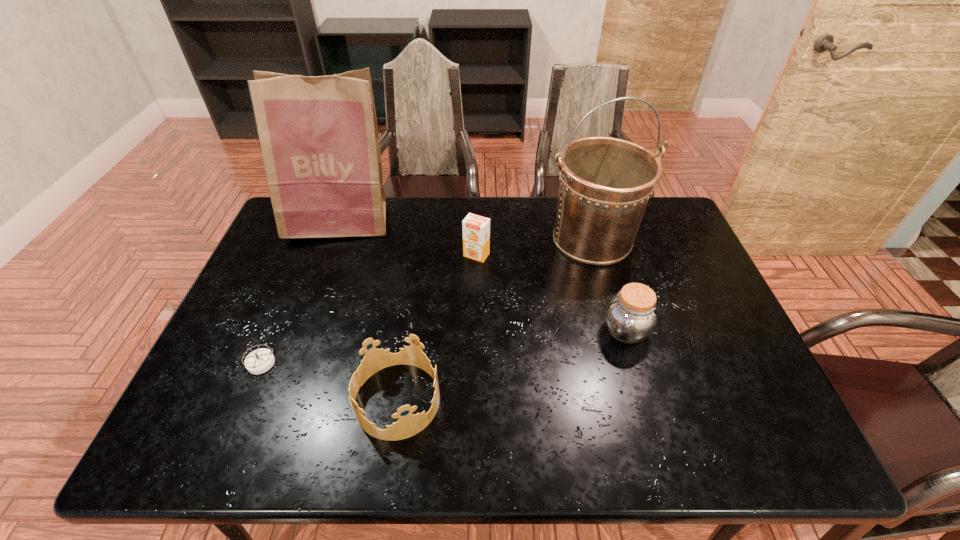
The width and height of the screenshot is (960, 540). Find the location of `blank area located on the front-facing side of the tiara`. blank area located on the front-facing side of the tiara is located at coordinates (593, 400).

You are a GUI agent. You are given a task and a screenshot of the screen. Output one action in this format:
    pyautogui.click(x=<x>, y=<y>)
    Task: Click on the free location located on the front of the compass
    
    Given the screenshot: What is the action you would take?
    pyautogui.click(x=247, y=395)

In order to click on grocery bag that is at the far edge in this screenshot , I will do `click(318, 135)`.

Identify the location of bucket at the far edge. (605, 183).

Where is `object present at the near edge`? This screenshot has width=960, height=540. object present at the near edge is located at coordinates (408, 425).

Identify the location of grocery bag positioned at the left edge. The width and height of the screenshot is (960, 540). (318, 135).

Locate an element on the screen. This screenshot has width=960, height=540. compass situated at the left edge is located at coordinates 259,361.

I want to click on object that is at the right edge, so click(x=605, y=183).

You are a GUI agent. You are given a task and a screenshot of the screen. Output one action in this format:
    pyautogui.click(x=<x>, y=<y>)
    Task: Click on the object located at the far left corner
    The height and width of the screenshot is (540, 960).
    Given the screenshot: What is the action you would take?
    pyautogui.click(x=318, y=135)

At what (x,y) coordinates should I click in order to perform the action: click on object that is positioned at the far right corner. Please return your answer as a coordinate pair (x, y). Image resolution: width=960 pixels, height=540 pixels. Looking at the image, I should click on (605, 183).